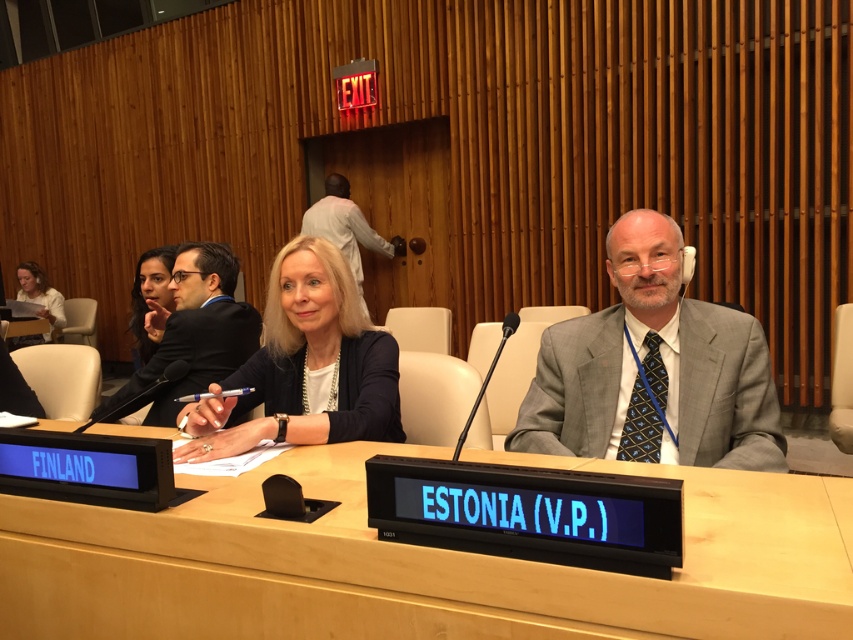
You are a photographer in the back of the room. You want to take a photo of the gray suit at center and the matte black hair at upper left. Which one will appear larger in your photo?

The gray suit at center will appear larger in the photo because it is closer to the viewer than the matte black hair at upper left.

You are organizing a photo shoot and need to ensure that all clothing items are visible in the frame. Given that the gray suit at center and the matte black blazer at center are both in the center of the image, which clothing item might require adjustment to ensure it is fully captured in the photo?

The gray suit at center occupies less space than the matte black blazer at center, so the matte black blazer at center might require adjustment to ensure it is fully captured in the photo since it takes up more area.

You are organizing a meeting in a conference room with a wooden table at center and a gray suit at center. Which object is bigger?

The wooden table at center is larger in size compared to the gray suit at center.